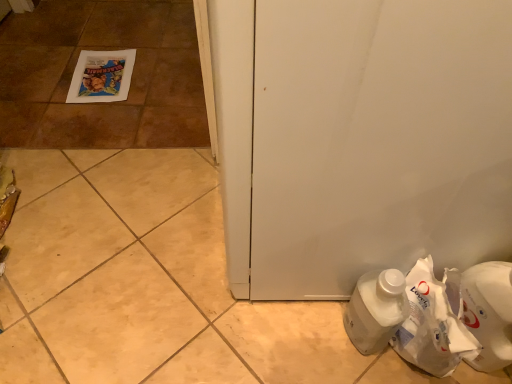
Question: Choose the correct answer: Is white plastic bottle at lower right inside matte paper poster at upper left or outside it?

Choices:
 (A) inside
 (B) outside

Answer: (B)

Question: Visually, is white plastic bottle at lower right positioned to the left or to the right of matte paper poster at upper left?

Choices:
 (A) right
 (B) left

Answer: (A)

Question: Which object is the farthest from the white plastic bottle at lower right?

Choices:
 (A) white paper bag at lower right
 (B) white matte door at center
 (C) matte paper poster at upper left

Answer: (C)

Question: Based on their relative distances, which object is nearer to the white matte door at center?

Choices:
 (A) matte paper poster at upper left
 (B) white plastic bottle at lower right
 (C) white paper bag at lower right

Answer: (B)